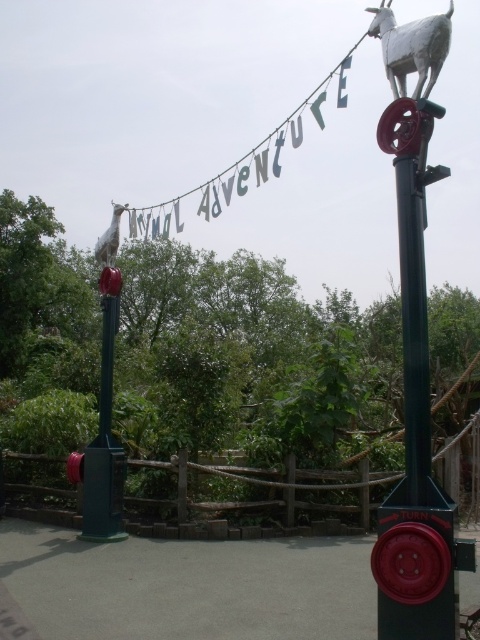
Question: Which object appears farthest from the camera in this image?

Choices:
 (A) green matte post at center
 (B) white matte goat at upper left

Answer: (B)

Question: Does metallic red wheel at right have a lesser width compared to white matte goat at upper left?

Choices:
 (A) no
 (B) yes

Answer: (B)

Question: Which of the following is the farthest from the observer?

Choices:
 (A) white matte goat at upper center
 (B) metallic red wheel at right
 (C) white matte goat at upper left

Answer: (C)

Question: Does green matte post at center have a lesser width compared to white matte goat at upper center?

Choices:
 (A) yes
 (B) no

Answer: (A)

Question: Can you confirm if metallic red wheel at right is positioned above white matte goat at upper center?

Choices:
 (A) yes
 (B) no

Answer: (B)

Question: Which of these objects is positioned closest to the metallic red wheel at right?

Choices:
 (A) green matte post at center
 (B) white matte goat at upper left
 (C) white matte goat at upper center

Answer: (A)